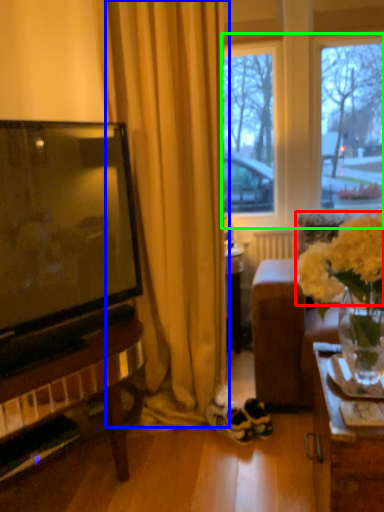
Question: Which is farther away from flower (highlighted by a red box)? curtain (highlighted by a blue box) or window frame (highlighted by a green box)?

Choices:
 (A) curtain
 (B) window frame

Answer: (B)